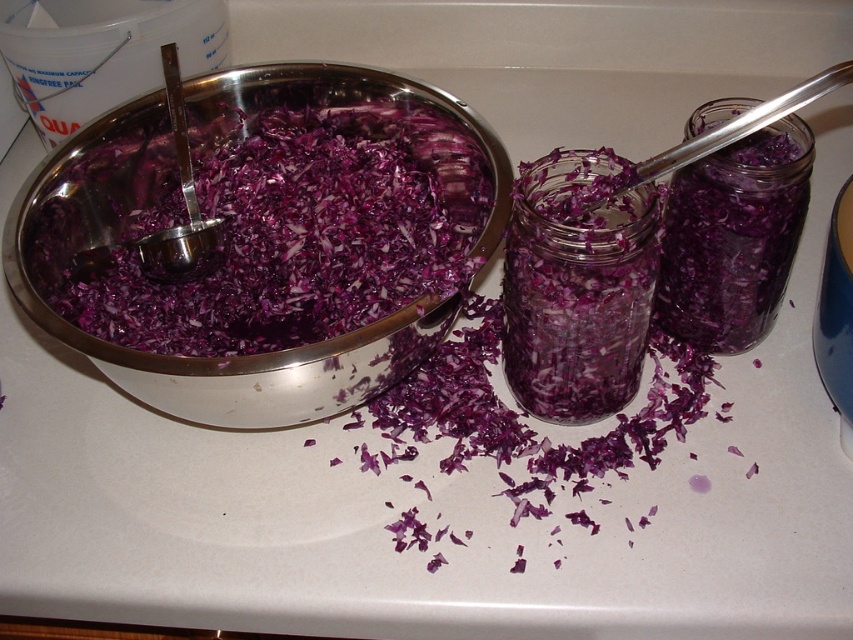
You are organizing the kitchen countertop and need to place a new spice jar. The spice jar is 10 cm in diameter. Can you fit it next to the shiny metal bowl at center without overlapping?

Result: The shiny metal bowl at center is located at point (227, 356). However, without knowing the exact dimensions of the countertop or the space around the bowl, it is impossible to determine if the spice jar will fit. Please measure the available space before placing the jar.

You are a chef preparing a dish and need to know which container is closer to you. You see the shiny metal bowl at center and the translucent glass jar at center. Which one is closer?

The shiny metal bowl at center is closer because it is in front of the translucent glass jar at center.